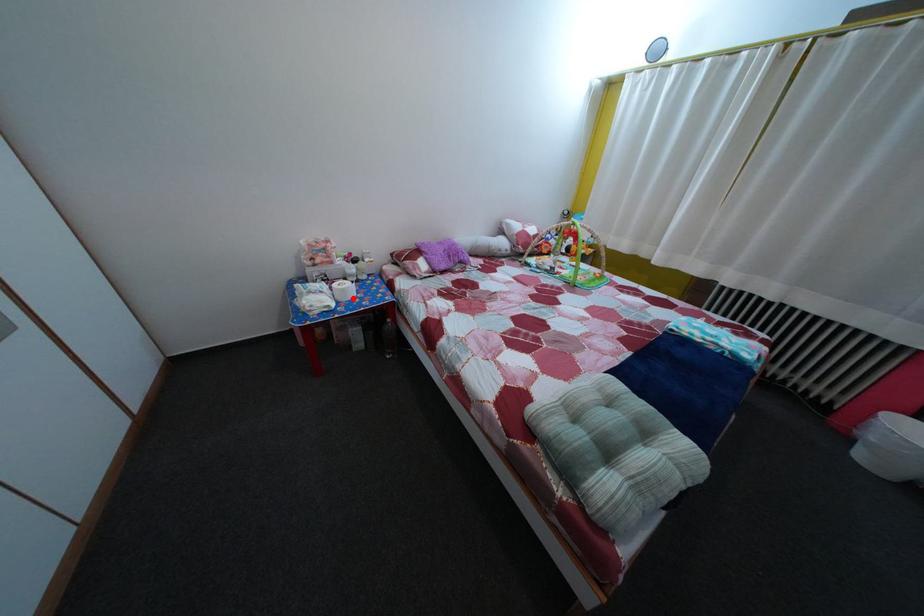
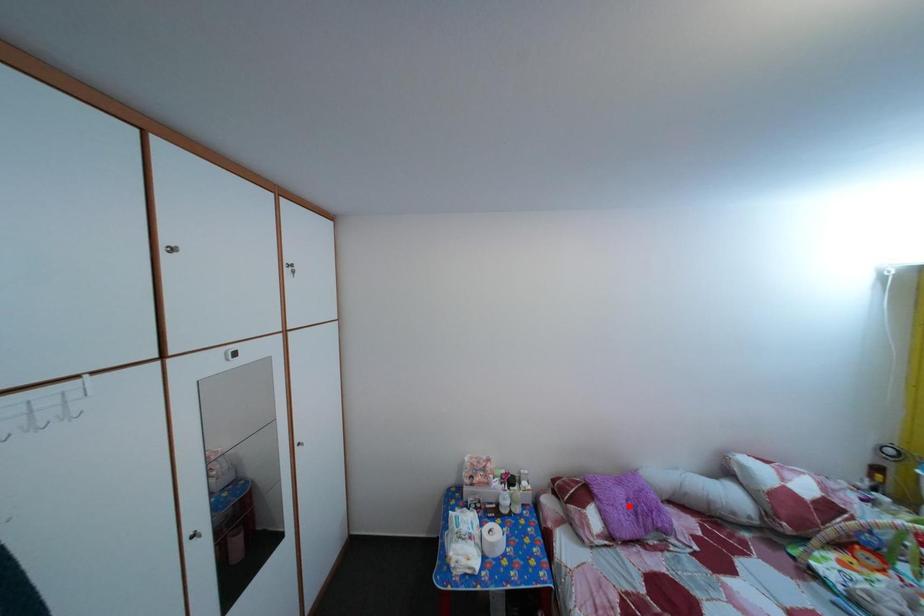
I am providing you with two images of the same scene from different viewpoints. A red point is marked on the first image and another point is marked on the second image. Do the highlighted points in image1 and image2 indicate the same real-world spot?

No